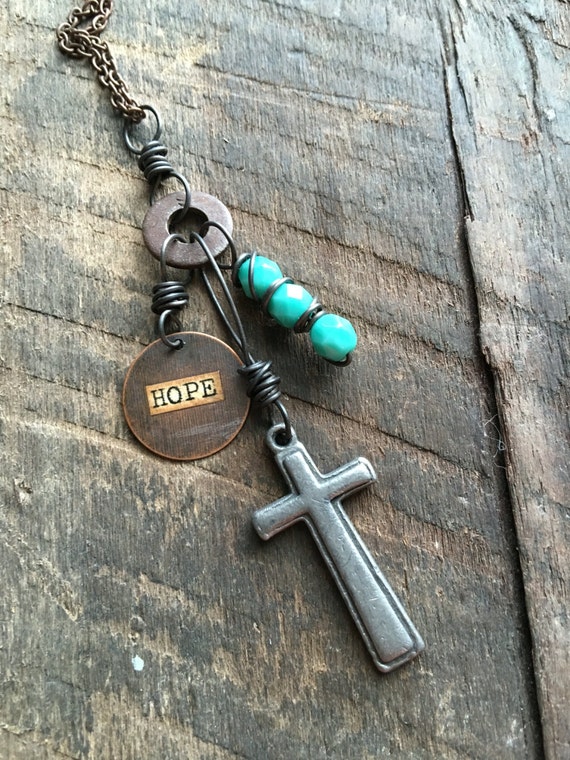
You are a GUI agent. You are given a task and a screenshot of the screen. Output one action in this format:
    pyautogui.click(x=<x>, y=<y>)
    Task: Click on the wooden surface
    The width and height of the screenshot is (570, 760).
    Given the screenshot: What is the action you would take?
    pyautogui.click(x=64, y=701), pyautogui.click(x=172, y=622), pyautogui.click(x=42, y=286), pyautogui.click(x=451, y=233), pyautogui.click(x=527, y=236), pyautogui.click(x=447, y=480), pyautogui.click(x=372, y=249)